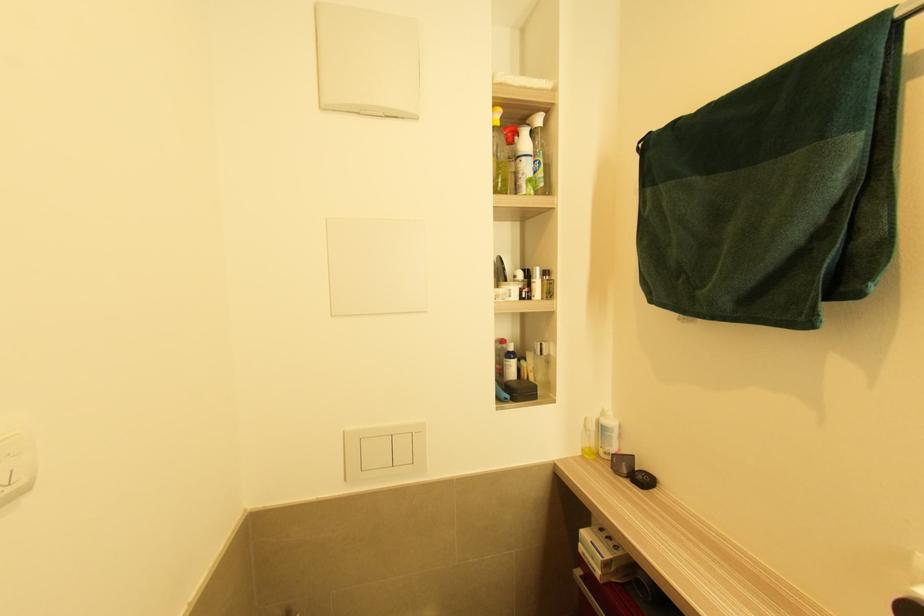
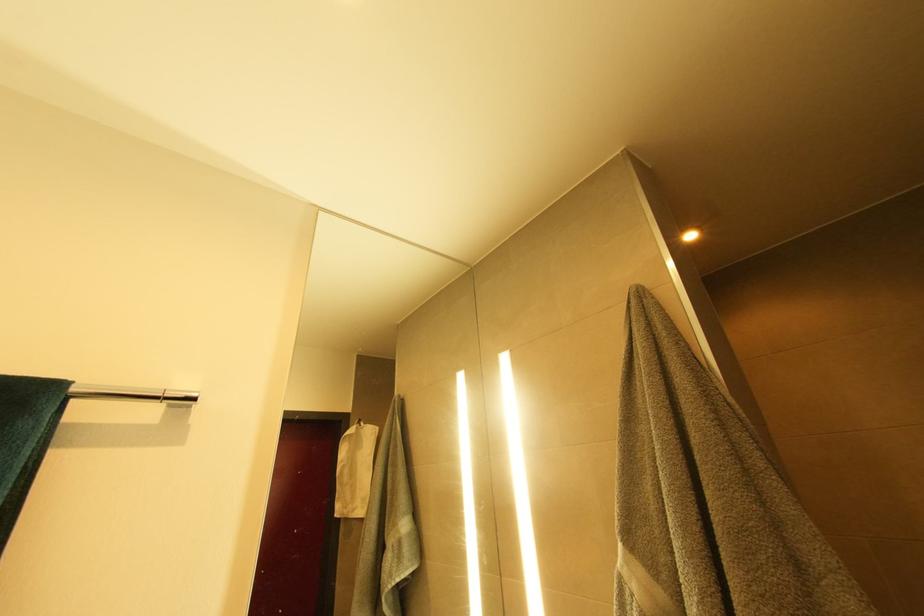
The images are taken continuously from a first-person perspective. In which direction is your viewpoint rotating?

The rotation direction of the camera is right-up.